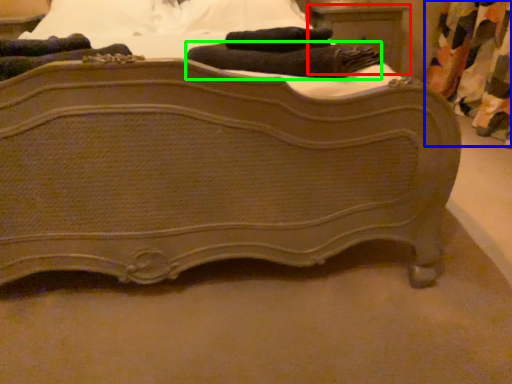
Question: Considering the real-world distances, which object is closest to nightstand (highlighted by a red box)? curtain (highlighted by a blue box) or bath towel (highlighted by a green box).

Choices:
 (A) curtain
 (B) bath towel

Answer: (A)